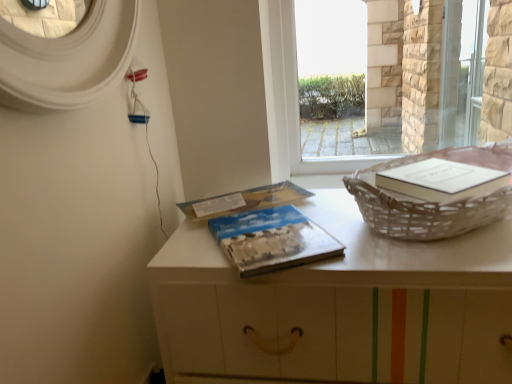
Image resolution: width=512 pixels, height=384 pixels. I want to click on vacant area to the left of blue textured paper at center, marked as the second paperback book in a back-to-front arrangement, so click(194, 246).